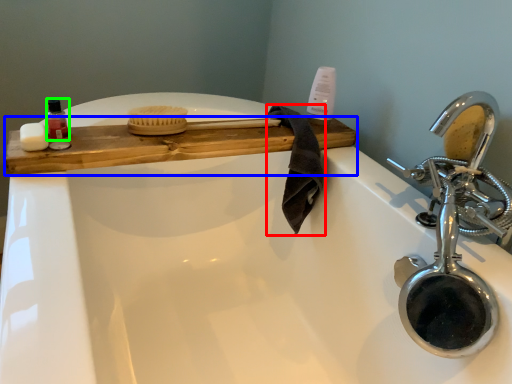
Question: Considering the real-world distances, which object is closest to bath towel (highlighted by a red box)? counter (highlighted by a blue box) or mouthwash (highlighted by a green box).

Choices:
 (A) counter
 (B) mouthwash

Answer: (A)